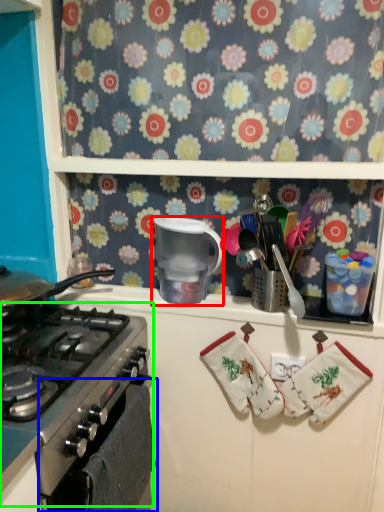
Question: Which object is the farthest from appliance (highlighted by a red box)? Choose among these: oven (highlighted by a blue box) or gas stove (highlighted by a green box).

Choices:
 (A) oven
 (B) gas stove

Answer: (A)